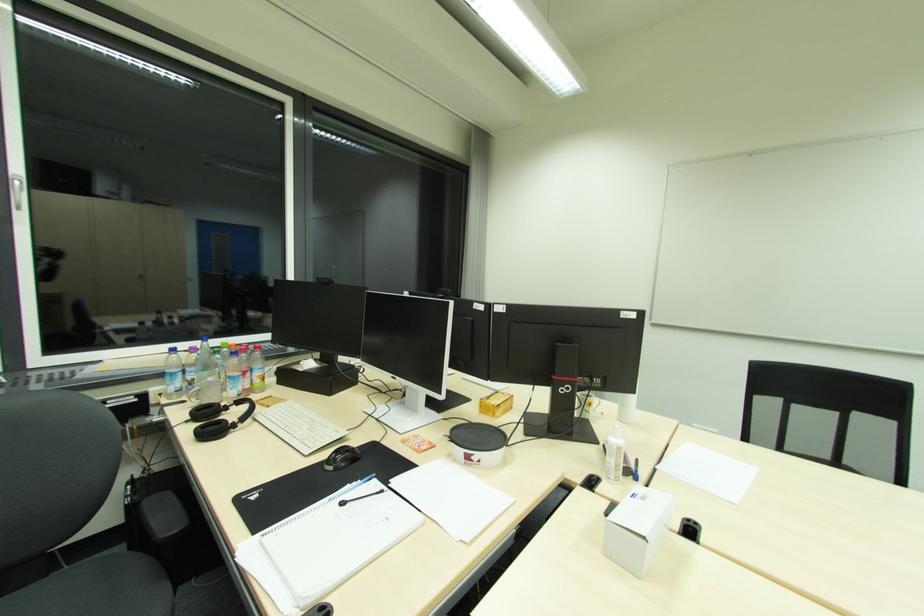
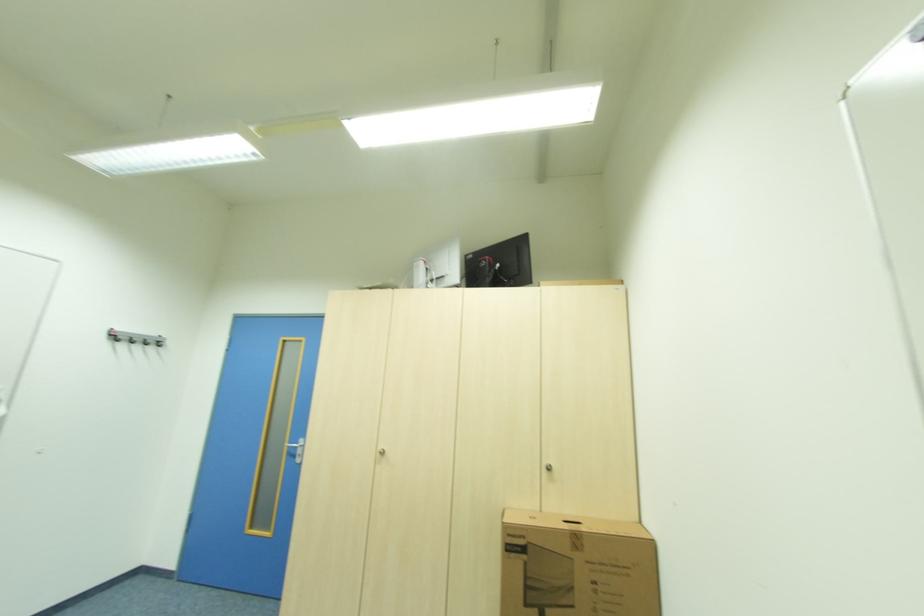
Question: How did the camera likely rotate?

Choices:
 (A) Left
 (B) Right
 (C) Up
 (D) Down

Answer: (B)